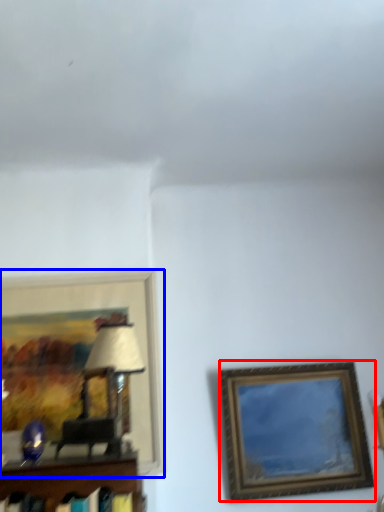
Question: Which point is closer to the camera, picture frame (highlighted by a red box) or picture frame (highlighted by a blue box)?

Choices:
 (A) picture frame
 (B) picture frame

Answer: (B)